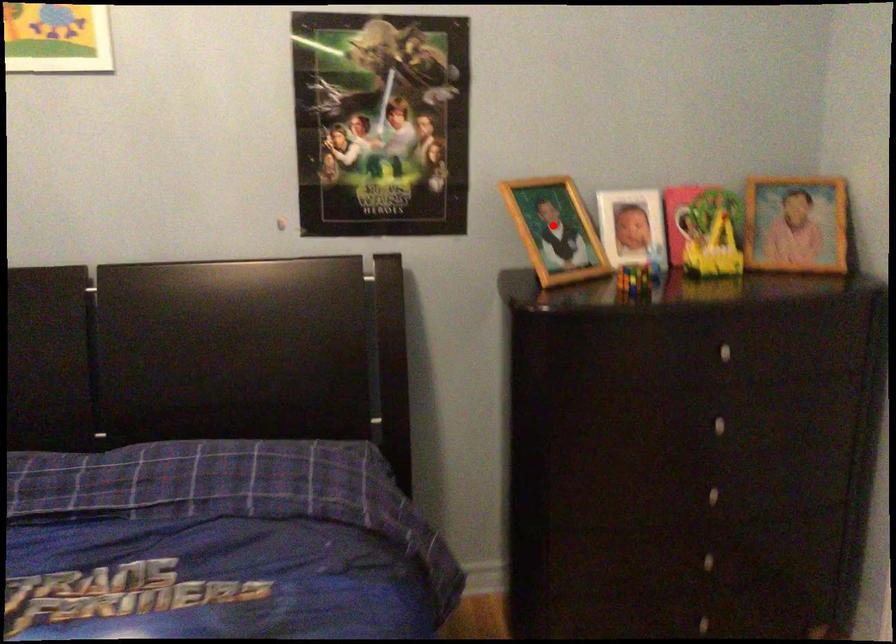
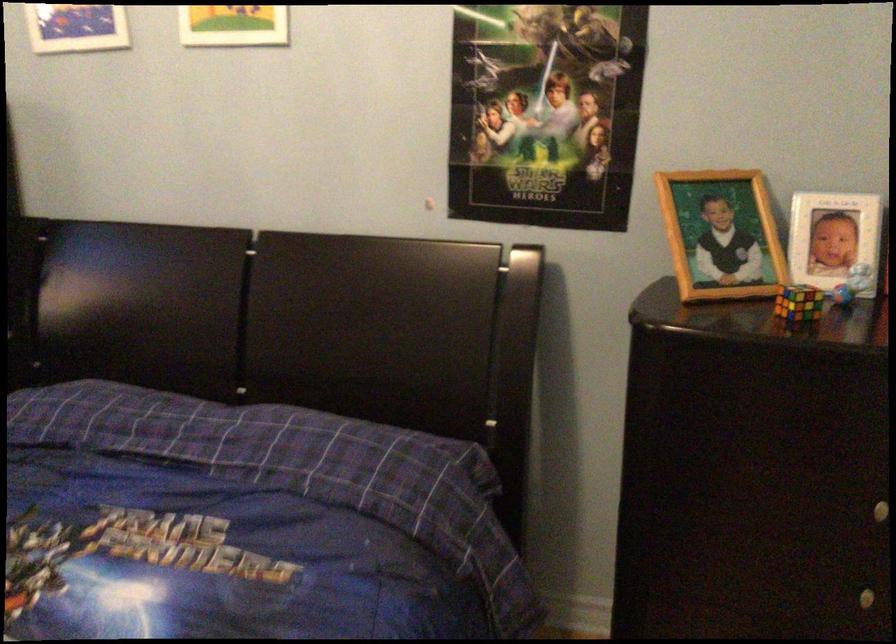
Question: I am providing you with two images of the same scene from different viewpoints. A red point is marked on the first image. Can you still see the location of the red point in image 2?

Choices:
 (A) Yes
 (B) No

Answer: (A)